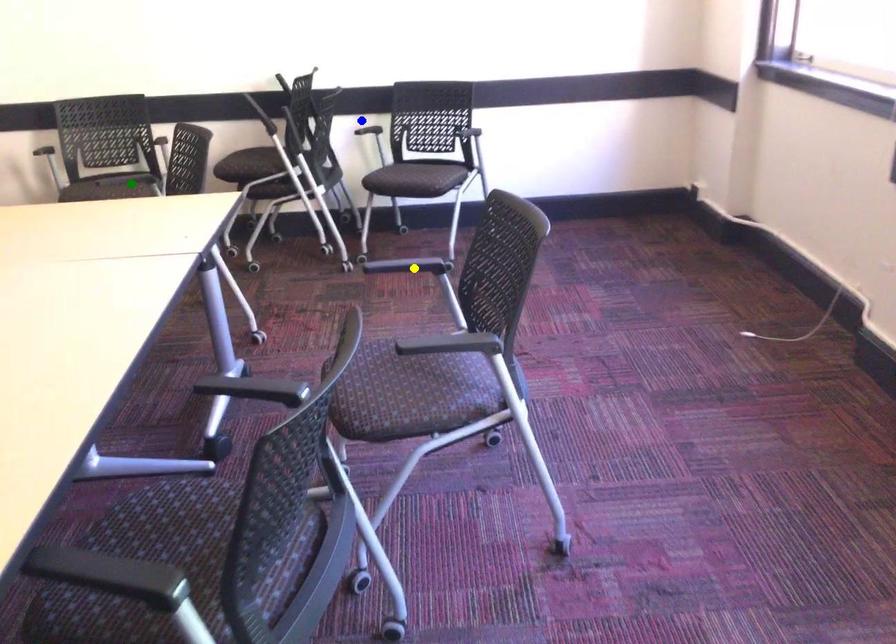
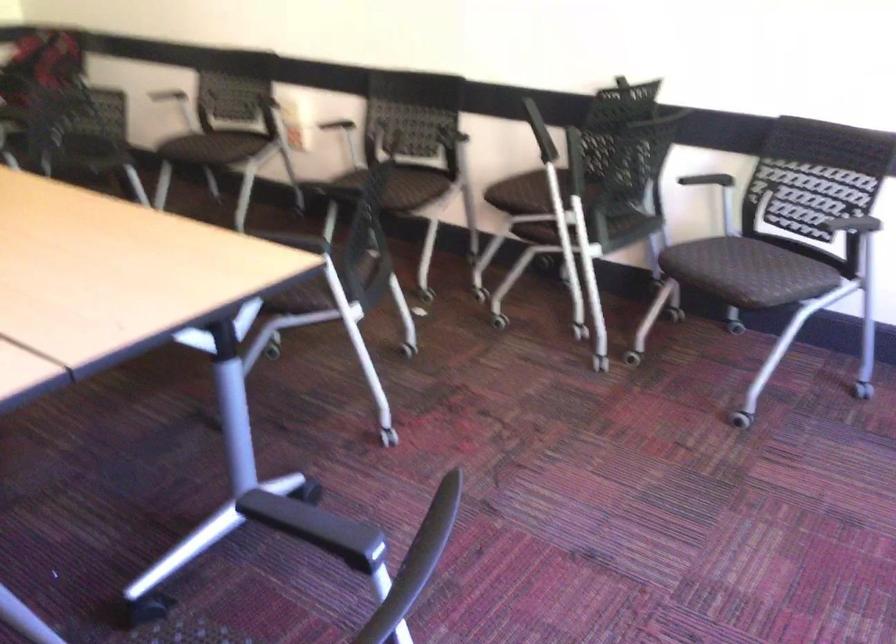
I am providing you with two images of the same scene from different viewpoints. Three points are marked in image1. Which point corresponds to a part or object that is occluded in image2?In image1, three points are marked. Which of them correspond to a part or object that is occluded in image2?Among the three points shown in image1, which one corresponds to a part or object that is no longer visible due to occlusion in image2?

yellow point cannot be seen in image2.